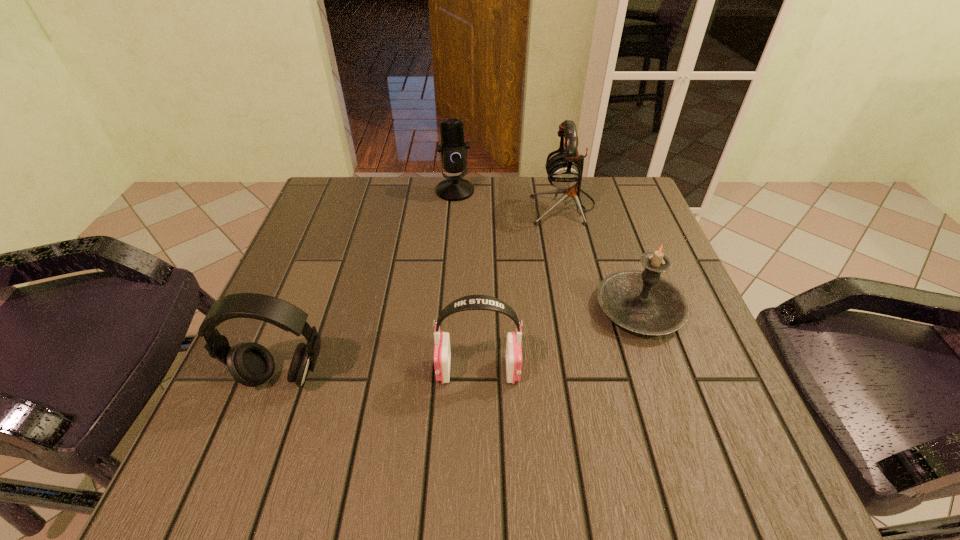
Find the location of a particular element. unoccupied area between the second earphone from right to left and the microphone is located at coordinates (467, 281).

Locate an element on the screen. The image size is (960, 540). free space between the microphone and the rightmost earphone is located at coordinates (509, 198).

The height and width of the screenshot is (540, 960). Identify the location of unoccupied position between the microphone and the farthest earphone. (509, 198).

Where is `object that stands as the second closest to the second earphone from left to right`? This screenshot has width=960, height=540. object that stands as the second closest to the second earphone from left to right is located at coordinates (251, 364).

Where is `the closest object to the second earphone from right to left`? This screenshot has width=960, height=540. the closest object to the second earphone from right to left is located at coordinates (643, 302).

Locate an element on the screen. This screenshot has height=540, width=960. earphone that is the second closest to the second earphone from left to right is located at coordinates (564, 169).

Identify which earphone is the second closest to the leftmost object. Please provide its 2D coordinates. Your answer should be formatted as a tuple, i.e. [(x, y)], where the tuple contains the x and y coordinates of a point satisfying the conditions above.

[(564, 169)]

Image resolution: width=960 pixels, height=540 pixels. In order to click on free space in the image that satisfies the following two spatial constraints: 1. on the stand of the third farthest object; 2. on the left side of the microphone in this screenshot , I will do `click(446, 309)`.

Image resolution: width=960 pixels, height=540 pixels. I want to click on vacant area that satisfies the following two spatial constraints: 1. on the outer surface of the second earphone from right to left; 2. on the ear cups of the leftmost earphone, so click(478, 377).

This screenshot has height=540, width=960. I want to click on free space that satisfies the following two spatial constraints: 1. on the outer surface of the second earphone from left to right; 2. on the ear cups of the leftmost object, so click(478, 377).